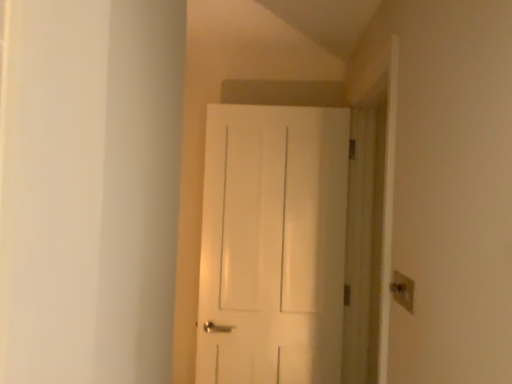
Question: Is white matte door at center spatially inside beige plastic light switch at upper right, or outside of it?

Choices:
 (A) outside
 (B) inside

Answer: (A)

Question: In terms of size, does white matte door at center appear bigger or smaller than beige plastic light switch at upper right?

Choices:
 (A) big
 (B) small

Answer: (A)

Question: In the image, is white matte door at center positioned in front of or behind beige plastic light switch at upper right?

Choices:
 (A) behind
 (B) front

Answer: (A)

Question: Is beige plastic light switch at upper right in front of or behind white matte door at center in the image?

Choices:
 (A) behind
 (B) front

Answer: (B)

Question: From a real-world perspective, relative to white matte door at center, is beige plastic light switch at upper right vertically above or below?

Choices:
 (A) below
 (B) above

Answer: (A)

Question: Is beige plastic light switch at upper right to the left or to the right of white matte door at center in the image?

Choices:
 (A) left
 (B) right

Answer: (B)

Question: Is beige plastic light switch at upper right inside the boundaries of white matte door at center, or outside?

Choices:
 (A) inside
 (B) outside

Answer: (B)